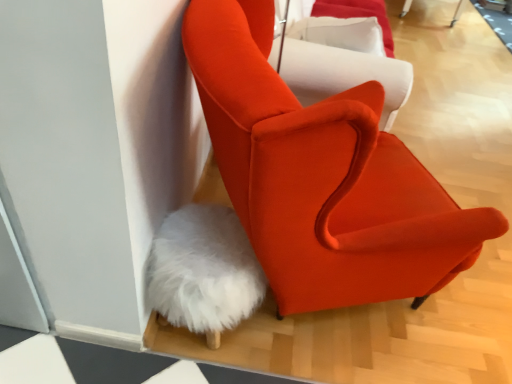
Question: Which direction should I rotate to look at orange fabric chair at upper center, which is the 1th chair in top-to-bottom order, — up or down?

Choices:
 (A) up
 (B) down

Answer: (A)

Question: Is orange fabric chair at upper center, acting as the 2th chair starting from the bottom, oriented away from matte orange armchair at center, the second chair in the top-to-bottom sequence?

Choices:
 (A) no
 (B) yes

Answer: (B)

Question: Is matte orange armchair at center, the second chair in the top-to-bottom sequence, surrounded by orange fabric chair at upper center, which is the 1th chair in top-to-bottom order?

Choices:
 (A) no
 (B) yes

Answer: (A)

Question: Is the position of orange fabric chair at upper center, which is the 1th chair in top-to-bottom order, more distant than that of matte orange armchair at center, the second chair in the top-to-bottom sequence?

Choices:
 (A) yes
 (B) no

Answer: (A)

Question: Could you tell me if orange fabric chair at upper center, which is the 1th chair in top-to-bottom order, is turned towards matte orange armchair at center, the second chair in the top-to-bottom sequence?

Choices:
 (A) no
 (B) yes

Answer: (A)

Question: Is orange fabric chair at upper center, which is the 1th chair in top-to-bottom order, thinner than matte orange armchair at center, the second chair in the top-to-bottom sequence?

Choices:
 (A) yes
 (B) no

Answer: (A)

Question: Is orange fabric chair at upper center, acting as the 2th chair starting from the bottom, bigger than matte orange armchair at center, which appears as the first chair when ordered from the bottom?

Choices:
 (A) no
 (B) yes

Answer: (A)

Question: Is matte orange armchair at center, the second chair in the top-to-bottom sequence, aimed at orange fabric chair at upper center, acting as the 2th chair starting from the bottom?

Choices:
 (A) yes
 (B) no

Answer: (B)

Question: Is matte orange armchair at center, which appears as the first chair when ordered from the bottom, smaller than orange fabric chair at upper center, which is the 1th chair in top-to-bottom order?

Choices:
 (A) no
 (B) yes

Answer: (A)

Question: Is matte orange armchair at center, which appears as the first chair when ordered from the bottom, positioned far away from orange fabric chair at upper center, acting as the 2th chair starting from the bottom?

Choices:
 (A) yes
 (B) no

Answer: (B)

Question: Considering the relative sizes of matte orange armchair at center, the second chair in the top-to-bottom sequence, and orange fabric chair at upper center, acting as the 2th chair starting from the bottom, in the image provided, is matte orange armchair at center, the second chair in the top-to-bottom sequence, shorter than orange fabric chair at upper center, acting as the 2th chair starting from the bottom,?

Choices:
 (A) yes
 (B) no

Answer: (B)

Question: Is the surface of matte orange armchair at center, which appears as the first chair when ordered from the bottom, in direct contact with orange fabric chair at upper center, acting as the 2th chair starting from the bottom?

Choices:
 (A) yes
 (B) no

Answer: (B)

Question: Is matte orange armchair at center, which appears as the first chair when ordered from the bottom, closer to camera compared to orange fabric chair at upper center, which is the 1th chair in top-to-bottom order?

Choices:
 (A) no
 (B) yes

Answer: (B)

Question: Considering the relative positions of matte orange armchair at center, the second chair in the top-to-bottom sequence, and orange fabric chair at upper center, acting as the 2th chair starting from the bottom, in the image provided, is matte orange armchair at center, the second chair in the top-to-bottom sequence, to the left or to the right of orange fabric chair at upper center, acting as the 2th chair starting from the bottom,?

Choices:
 (A) left
 (B) right

Answer: (A)